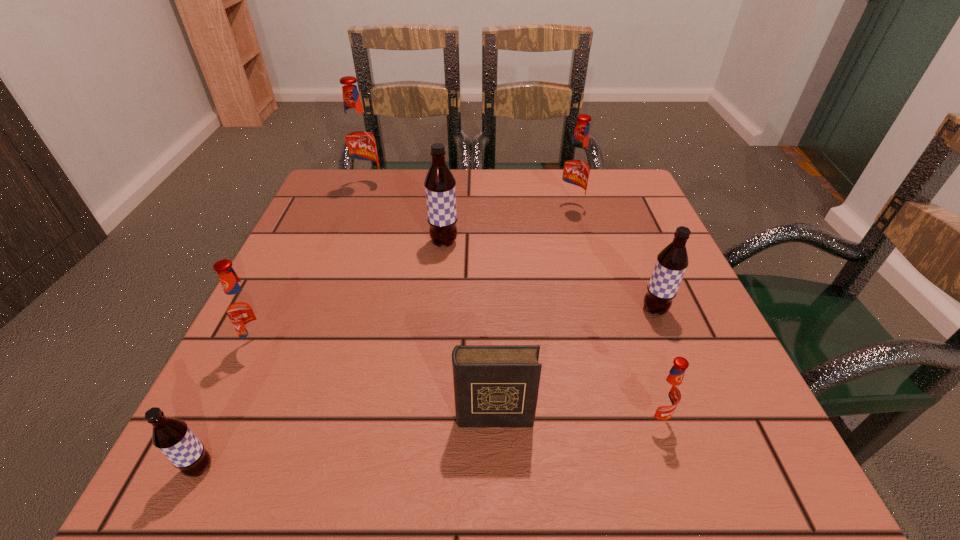
Find the location of `diary`. diary is located at coordinates (494, 385).

Where is `dark diary`? dark diary is located at coordinates (494, 385).

This screenshot has height=540, width=960. Find the location of `the smallest red root beer`. the smallest red root beer is located at coordinates (666, 394).

Image resolution: width=960 pixels, height=540 pixels. In order to click on the second nearest root beer in this screenshot , I will do `click(666, 394)`.

This screenshot has width=960, height=540. Identify the location of the smallest brown root beer. (172, 436).

Find the location of `the nearest root beer`. the nearest root beer is located at coordinates (172, 436).

Locate an element on the screen. The width and height of the screenshot is (960, 540). vacant space positioned 0.270m on the right of the farthest root beer is located at coordinates (488, 186).

Where is `vacant region located on the front of the second farthest root beer`? This screenshot has width=960, height=540. vacant region located on the front of the second farthest root beer is located at coordinates coord(583,255).

Locate an element on the screen. vacant space situated on the right of the fourth object from left to right is located at coordinates (482, 243).

At what (x,y) coordinates should I click in order to perform the action: click on vacant space located on the front of the fifth nearest object. Please return your answer as a coordinate pair (x, y). The height and width of the screenshot is (540, 960). Looking at the image, I should click on (677, 365).